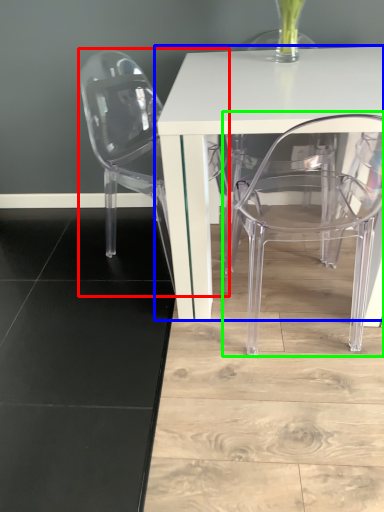
Question: Which object is the farthest from chair (highlighted by a red box)? Choose among these: table (highlighted by a blue box) or chair (highlighted by a green box).

Choices:
 (A) table
 (B) chair

Answer: (B)